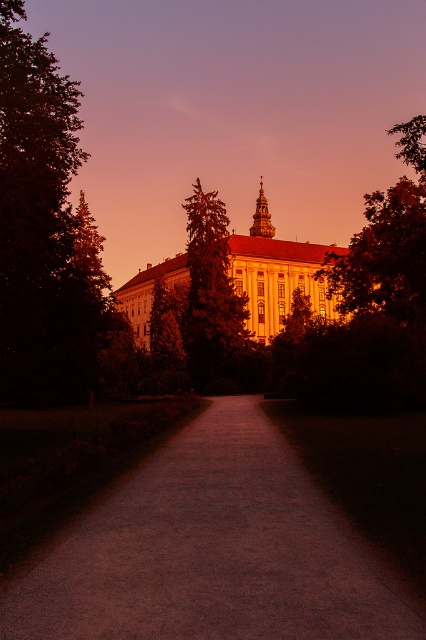
Question: Which of these objects is positioned closest to the dark green leafy tree at left?

Choices:
 (A) dusty gravel path at center
 (B) golden stone palace at center

Answer: (A)

Question: Which of the following is the closest to the observer?

Choices:
 (A) (216, 269)
 (B) (92, 387)
 (C) (189, 534)
 (D) (259, 237)

Answer: (C)

Question: From the image, what is the correct spatial relationship of golden stone palace at center in relation to green leafy tree at center?

Choices:
 (A) above
 (B) below

Answer: (B)

Question: Is golden stone palace at center smaller than green leafy tree at center?

Choices:
 (A) yes
 (B) no

Answer: (B)

Question: Is dark green leafy tree at left wider than golden stone palace at center?

Choices:
 (A) no
 (B) yes

Answer: (B)

Question: Which point is closer to the camera?

Choices:
 (A) (184, 579)
 (B) (209, 234)
 (C) (290, 260)

Answer: (A)